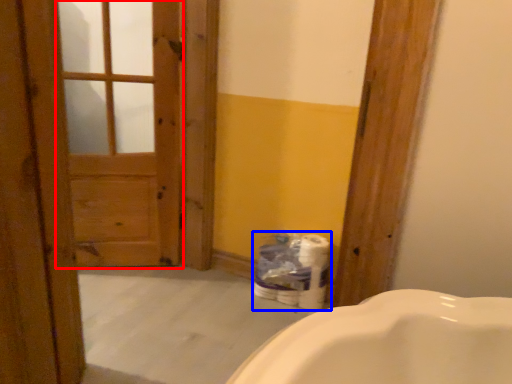
Question: Among these objects, which one is nearest to the camera, screen door (highlighted by a red box) or toilet paper (highlighted by a blue box)?

Choices:
 (A) screen door
 (B) toilet paper

Answer: (A)